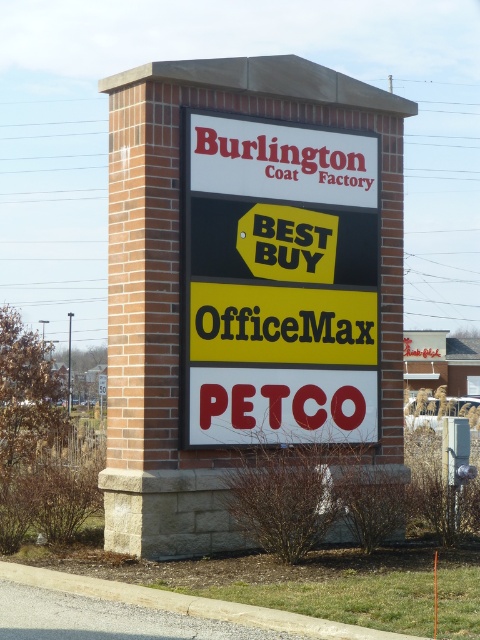
Question: Can you confirm if brick sign at center is smaller than white plastic sign at center?

Choices:
 (A) yes
 (B) no

Answer: (B)

Question: Can you confirm if brick sign at center is positioned to the left of white plastic sign at center?

Choices:
 (A) yes
 (B) no

Answer: (A)

Question: Among these points, which one is nearest to the camera?

Choices:
 (A) (220, 372)
 (B) (196, 308)

Answer: (B)

Question: Does brick sign at center lie in front of white plastic sign at center?

Choices:
 (A) yes
 (B) no

Answer: (A)

Question: Which point is farther from the camera taking this photo?

Choices:
 (A) (214, 77)
 (B) (206, 340)

Answer: (A)

Question: Which point is farther from the camera taking this photo?

Choices:
 (A) (371, 436)
 (B) (241, 288)

Answer: (A)